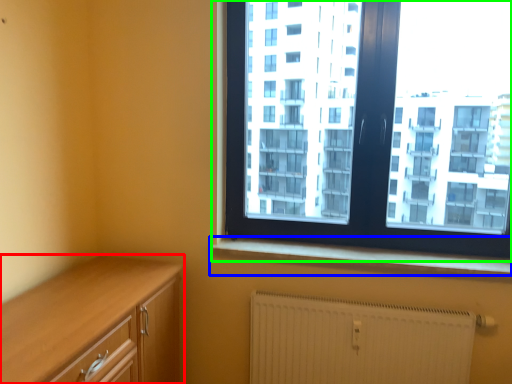
Question: Which is nearer to the cabinetry (highlighted by a red box)? window sill (highlighted by a blue box) or window (highlighted by a green box).

Choices:
 (A) window sill
 (B) window

Answer: (A)